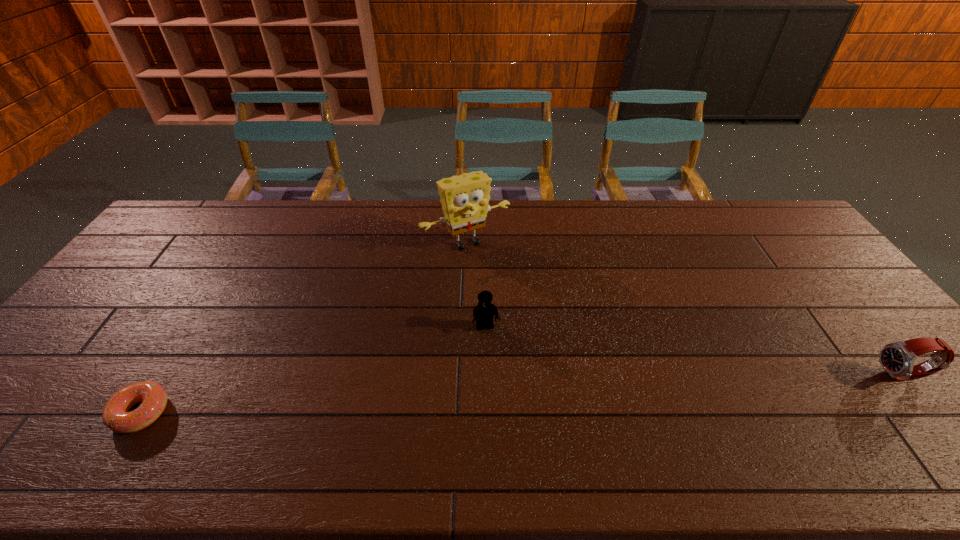
Locate an element on the screen. The image size is (960, 540). vacant area that lies between the watch and the shortest object is located at coordinates [522, 394].

Where is `vacant region between the watch and the shortest object`? The height and width of the screenshot is (540, 960). vacant region between the watch and the shortest object is located at coordinates (522, 394).

Identify the location of vacant area between the shortest object and the watch. 522,394.

You are a GUI agent. You are given a task and a screenshot of the screen. Output one action in this format:
    pyautogui.click(x=<x>, y=<y>)
    Task: Click on the free space between the farthest object and the rightmost object
    
    Given the screenshot: What is the action you would take?
    pyautogui.click(x=684, y=309)

Identify the location of free area in between the leftmost object and the rightmost object. (522, 394).

Identify the location of object that is the closest to the rightmost object. (483, 313).

Identify which object is located as the nearest to the doughnut. Please provide its 2D coordinates. Your answer should be formatted as a tuple, i.e. [(x, y)], where the tuple contains the x and y coordinates of a point satisfying the conditions above.

[(483, 313)]

You are a GUI agent. You are given a task and a screenshot of the screen. Output one action in this format:
    pyautogui.click(x=<x>, y=<y>)
    Task: Click on the vacant position in the image that satisfies the following two spatial constraints: 1. on the back side of the tallest object; 2. on the left side of the leftmost object
    This screenshot has height=540, width=960.
    Given the screenshot: What is the action you would take?
    pyautogui.click(x=247, y=242)

Identify the location of vacant space that satisfies the following two spatial constraints: 1. on the front side of the tallest object; 2. on the face of the rightmost object. (462, 376).